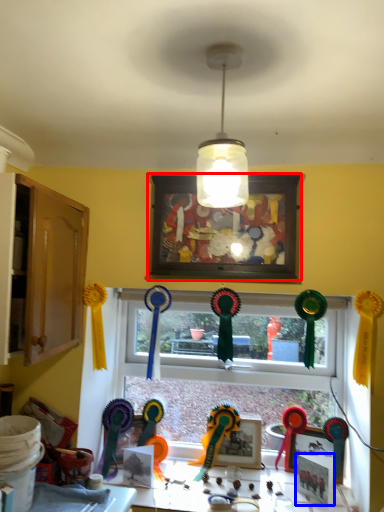
Question: Which of the following is the closest to the observer, picture frame (highlighted by a red box) or picture frame (highlighted by a blue box)?

Choices:
 (A) picture frame
 (B) picture frame

Answer: (A)